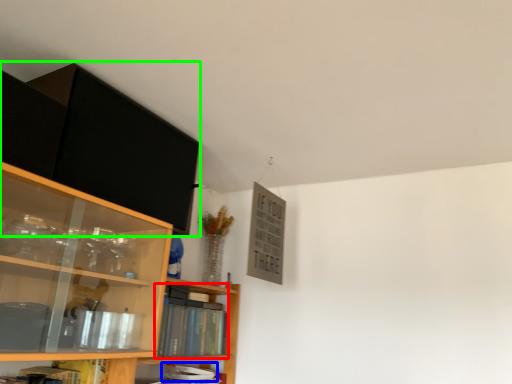
Question: Based on their relative distances, which object is nearer to book (highlighted by a red box)? Choose from book (highlighted by a blue box) and cabinetry (highlighted by a green box).

Choices:
 (A) book
 (B) cabinetry

Answer: (A)